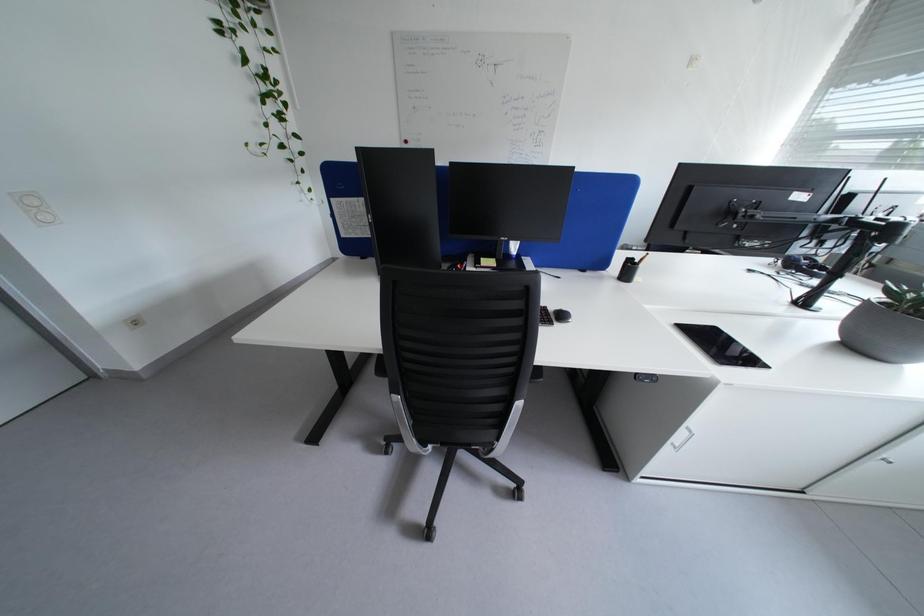
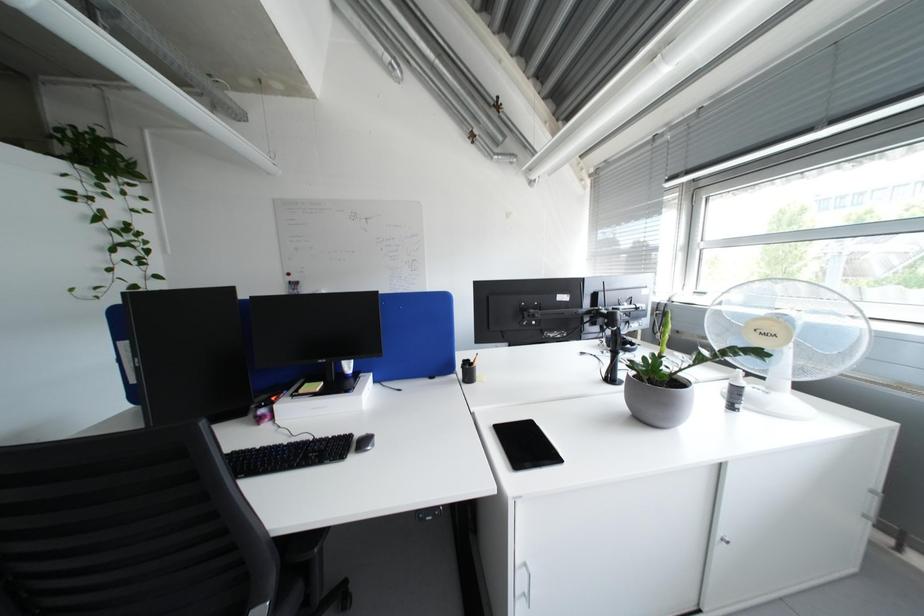
Question: The images are taken continuously from a first-person perspective. In which direction is your viewpoint rotating?

Choices:
 (A) Left
 (B) Right
 (C) Up
 (D) Down

Answer: (C)